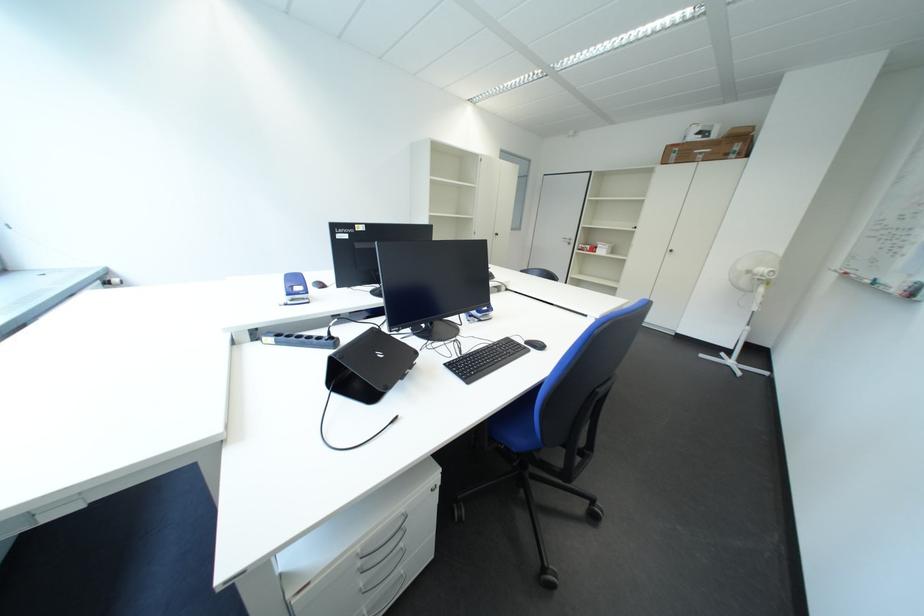
The height and width of the screenshot is (616, 924). What do you see at coordinates (565, 241) in the screenshot?
I see `a silver door handle` at bounding box center [565, 241].